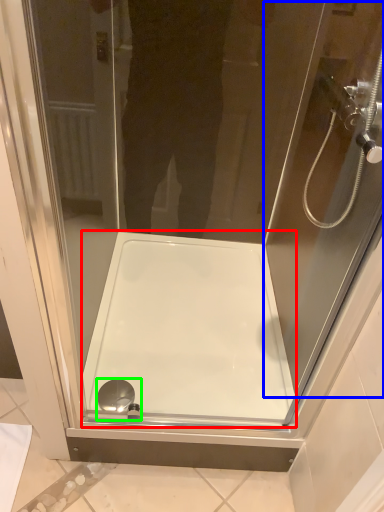
Question: Which object is positioned closest to bath (highlighted by a red box)? Select from screen door (highlighted by a blue box) and shower (highlighted by a green box).

Choices:
 (A) screen door
 (B) shower

Answer: (B)